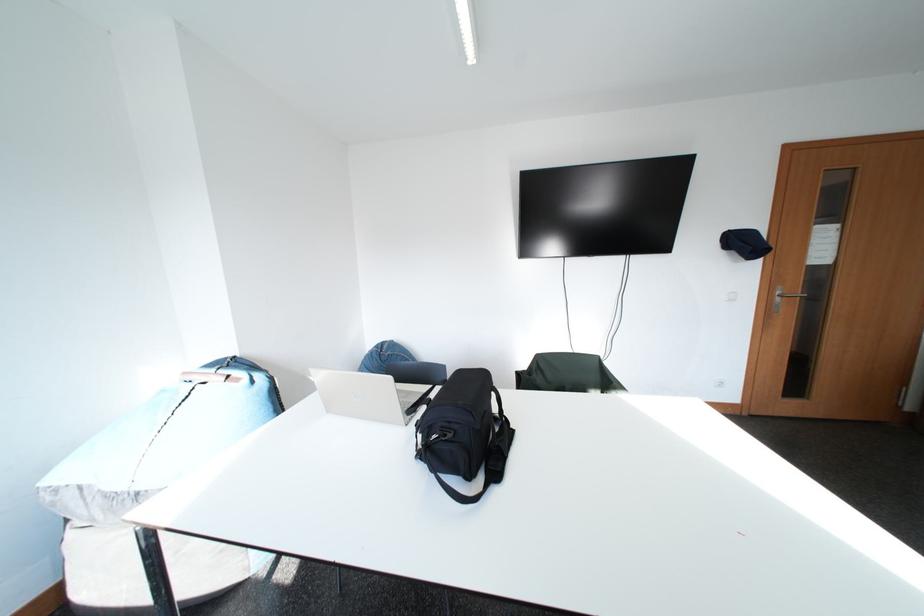
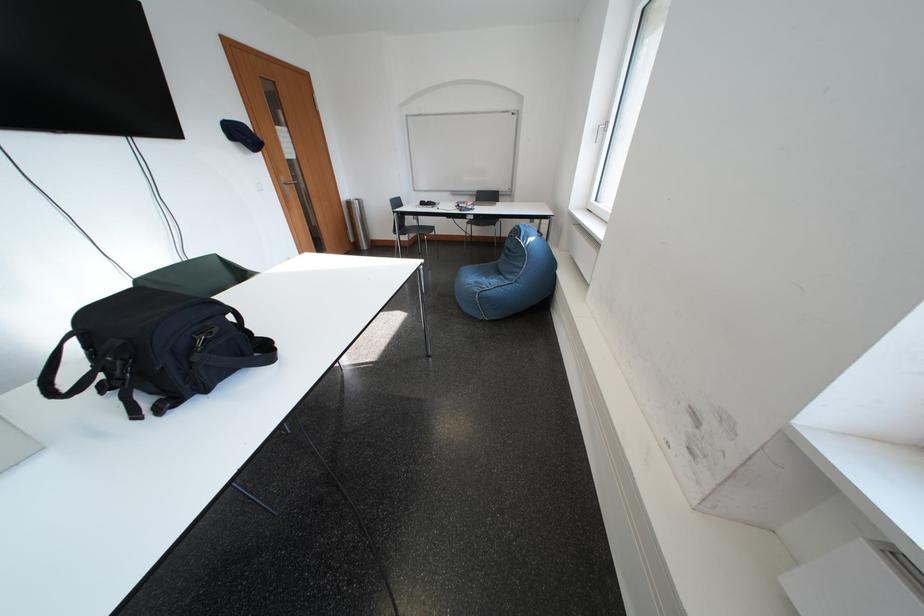
Based on the continuous images, in which direction is the camera rotating?

The rotation direction of the camera is right-down.